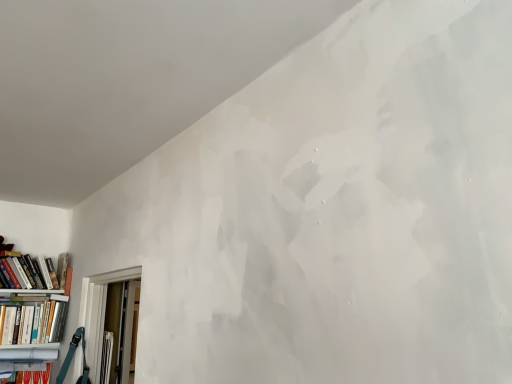
Image resolution: width=512 pixels, height=384 pixels. What do you see at coordinates (35, 271) in the screenshot?
I see `hardcover book at left, the 1th book positioned from the top` at bounding box center [35, 271].

Find the location of a particular element. This screenshot has width=512, height=384. matte white bookcase at lower left is located at coordinates (31, 309).

Find the location of `hardcover book at left, the 1th book positioned from the top`. hardcover book at left, the 1th book positioned from the top is located at coordinates (35, 271).

Between point (63, 273) and point (28, 342), which one is positioned in front?

Point (28, 342)

Who is more distant, matte white bookcase at lower left or hardcover book at left, placed as the 2th book when sorted from top to bottom?

hardcover book at left, placed as the 2th book when sorted from top to bottom.

Consider the image. Which object is wider, matte white bookcase at lower left or hardcover book at left, placed as the 2th book when sorted from top to bottom?

With larger width is hardcover book at left, placed as the 2th book when sorted from top to bottom.

Between matte white bookcase at lower left and hardcover book at left, placed as the 2th book when sorted from top to bottom, which one appears on the left side from the viewer's perspective?

From the viewer's perspective, hardcover book at left, placed as the 2th book when sorted from top to bottom, appears more on the left side.

From a real-world perspective, which is physically above, matte white bookcase at lower left or hardcover book at left, the 1th book positioned from the top?

From a 3D spatial view, hardcover book at left, the 1th book positioned from the top, is above.

Would you say matte white bookcase at lower left is outside hardcover book at left, the 2th book ordered from the bottom?

Yes, matte white bookcase at lower left is located beyond the bounds of hardcover book at left, the 2th book ordered from the bottom.

Considering their positions, is matte white bookcase at lower left located in front of or behind hardcover book at left, the 2th book ordered from the bottom?

Visually, matte white bookcase at lower left is located in front of hardcover book at left, the 2th book ordered from the bottom.

Locate an element on the screen. This screenshot has height=384, width=512. bookcase below the hardcover book at left, the 1th book positioned from the top (from the image's perspective) is located at coordinates (31, 309).

From the image's perspective, who appears lower, hardcover book at left, arranged as the first book when ordered from the bottom, or matte white bookcase at lower left?

matte white bookcase at lower left appears lower in the image.

Between hardcover book at left, arranged as the first book when ordered from the bottom, and matte white bookcase at lower left, which one has smaller width?

With smaller width is matte white bookcase at lower left.

Is hardcover book at left, arranged as the first book when ordered from the bottom, touching matte white bookcase at lower left?

Indeed, hardcover book at left, arranged as the first book when ordered from the bottom, and matte white bookcase at lower left are beside each other and touching.

Is hardcover book at left, placed as the 2th book when sorted from top to bottom, aimed at hardcover book at left, the 2th book ordered from the bottom?

No.

Does point (19, 305) come closer to viewer compared to point (15, 273)?

Yes, point (19, 305) is closer to viewer.

Based on their positions, is hardcover book at left, placed as the 2th book when sorted from top to bottom, located to the left or right of hardcover book at left, the 2th book ordered from the bottom?

In the image, hardcover book at left, placed as the 2th book when sorted from top to bottom, appears on the left side of hardcover book at left, the 2th book ordered from the bottom.

Would you say hardcover book at left, arranged as the first book when ordered from the bottom, is inside or outside hardcover book at left, the 2th book ordered from the bottom?

hardcover book at left, arranged as the first book when ordered from the bottom, is not inside hardcover book at left, the 2th book ordered from the bottom, it's outside.

From the picture: Considering the relative positions of hardcover book at left, the 1th book positioned from the top, and hardcover book at left, placed as the 2th book when sorted from top to bottom, in the image provided, is hardcover book at left, the 1th book positioned from the top, to the left or to the right of hardcover book at left, placed as the 2th book when sorted from top to bottom,?

Clearly, hardcover book at left, the 1th book positioned from the top, is on the right of hardcover book at left, placed as the 2th book when sorted from top to bottom, in the image.

Identify the location of book located in front of the hardcover book at left, the 1th book positioned from the top. (33, 319).

Considering the positions of objects hardcover book at left, the 1th book positioned from the top, and hardcover book at left, arranged as the first book when ordered from the bottom, in the image provided, who is behind, hardcover book at left, the 1th book positioned from the top, or hardcover book at left, arranged as the first book when ordered from the bottom,?

hardcover book at left, the 1th book positioned from the top.

From the image's perspective, is hardcover book at left, the 1th book positioned from the top, above or below hardcover book at left, arranged as the first book when ordered from the bottom?

From the image's perspective, hardcover book at left, the 1th book positioned from the top, appears above hardcover book at left, arranged as the first book when ordered from the bottom.

Is hardcover book at left, the 1th book positioned from the top, in front of or behind matte white bookcase at lower left in the image?

hardcover book at left, the 1th book positioned from the top, is behind matte white bookcase at lower left.

In the scene shown: From the image's perspective, between hardcover book at left, the 1th book positioned from the top, and matte white bookcase at lower left, which one is located above?

hardcover book at left, the 1th book positioned from the top.

Who is taller, hardcover book at left, the 2th book ordered from the bottom, or matte white bookcase at lower left?

With more height is matte white bookcase at lower left.

From a real-world perspective, which book is the 1st one above the matte white bookcase at lower left? Please provide its 2D coordinates.

[(33, 319)]

Find the location of a particular element. bookcase in front of the hardcover book at left, the 1th book positioned from the top is located at coordinates (31, 309).

Based on their spatial positions, is matte white bookcase at lower left or hardcover book at left, arranged as the first book when ordered from the bottom, further from hardcover book at left, the 1th book positioned from the top?

Based on the image, hardcover book at left, arranged as the first book when ordered from the bottom, appears to be further to hardcover book at left, the 1th book positioned from the top.

Which object lies further to the anchor point hardcover book at left, arranged as the first book when ordered from the bottom, hardcover book at left, the 2th book ordered from the bottom, or matte white bookcase at lower left?

hardcover book at left, the 2th book ordered from the bottom, lies further to hardcover book at left, arranged as the first book when ordered from the bottom, than the other object.

Based on their spatial positions, is hardcover book at left, placed as the 2th book when sorted from top to bottom, or matte white bookcase at lower left closer to hardcover book at left, the 1th book positioned from the top?

matte white bookcase at lower left.

When comparing their distances from matte white bookcase at lower left, does hardcover book at left, the 2th book ordered from the bottom, or hardcover book at left, arranged as the first book when ordered from the bottom, seem closer?

hardcover book at left, arranged as the first book when ordered from the bottom, lies closer to matte white bookcase at lower left than the other object.

Which object lies nearer to the anchor point matte white bookcase at lower left, hardcover book at left, arranged as the first book when ordered from the bottom, or hardcover book at left, the 2th book ordered from the bottom?

hardcover book at left, arranged as the first book when ordered from the bottom, is closer to matte white bookcase at lower left.

Looking at this image, when comparing their distances from hardcover book at left, arranged as the first book when ordered from the bottom, does matte white bookcase at lower left or hardcover book at left, the 2th book ordered from the bottom, seem closer?

Among the two, matte white bookcase at lower left is located nearer to hardcover book at left, arranged as the first book when ordered from the bottom.

Where is `book between hardcover book at left, the 2th book ordered from the bottom, and matte white bookcase at lower left from top to bottom`? book between hardcover book at left, the 2th book ordered from the bottom, and matte white bookcase at lower left from top to bottom is located at coordinates (33, 319).